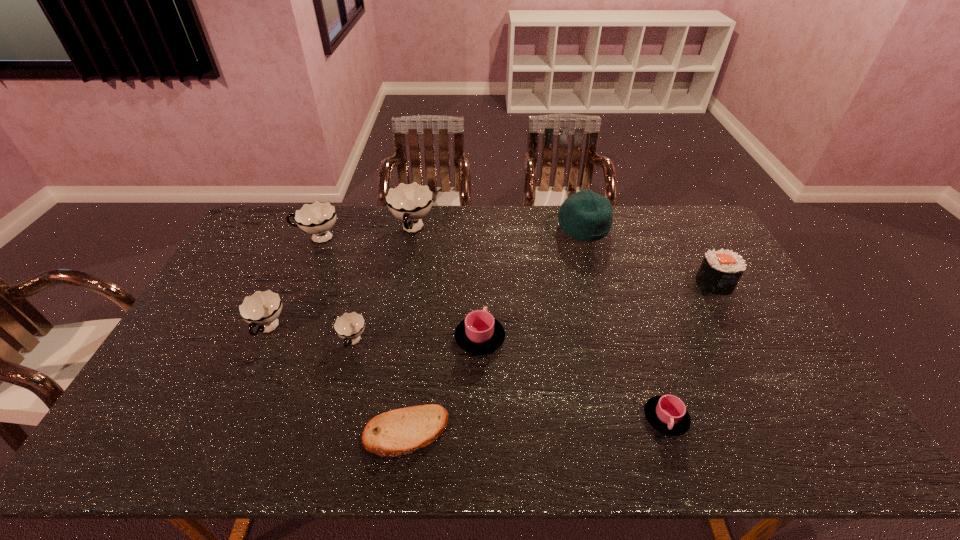
Locate an element on the screen. Image resolution: width=960 pixels, height=540 pixels. free spot between the second smallest white cup and the second shortest object is located at coordinates (467, 374).

Identify which object is the third closest to the fifth shortest cup. Please provide its 2D coordinates. Your answer should be formatted as a tuple, i.e. [(x, y)], where the tuple contains the x and y coordinates of a point satisfying the conditions above.

[(349, 326)]

The height and width of the screenshot is (540, 960). Identify the location of object that can be found as the fifth closest to the second biggest white cup. tap(398, 432).

Point out which cup is positioned as the second nearest to the beanie. Please provide its 2D coordinates. Your answer should be formatted as a tuple, i.e. [(x, y)], where the tuple contains the x and y coordinates of a point satisfying the conditions above.

[(410, 202)]

Select which cup appears as the fifth closest to the left pink cup. Please provide its 2D coordinates. Your answer should be formatted as a tuple, i.e. [(x, y)], where the tuple contains the x and y coordinates of a point satisfying the conditions above.

[(317, 218)]

Image resolution: width=960 pixels, height=540 pixels. I want to click on the fourth closest white cup to the rightmost object, so click(262, 308).

Locate which white cup ranks in proximity to the pita bread. Please provide its 2D coordinates. Your answer should be formatted as a tuple, i.e. [(x, y)], where the tuple contains the x and y coordinates of a point satisfying the conditions above.

[(349, 326)]

Where is `vacant space that satisfies the following two spatial constraints: 1. on the side with the handle of the beanie; 2. on the left side of the fifth cup from left to right`? This screenshot has height=540, width=960. vacant space that satisfies the following two spatial constraints: 1. on the side with the handle of the beanie; 2. on the left side of the fifth cup from left to right is located at coordinates (480, 228).

Identify the location of free space that satisfies the following two spatial constraints: 1. on the side with the handle of the fifth cup from left to right; 2. on the right side of the rightmost object. (480, 284).

Where is `free space that satisfies the following two spatial constraints: 1. on the front side of the beanie; 2. on the left side of the sushi`? Image resolution: width=960 pixels, height=540 pixels. free space that satisfies the following two spatial constraints: 1. on the front side of the beanie; 2. on the left side of the sushi is located at coordinates (599, 284).